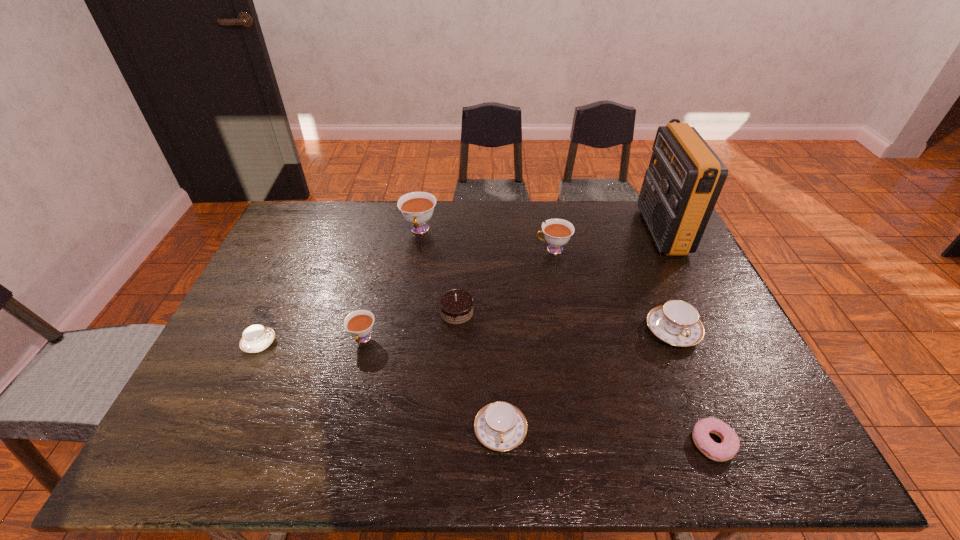
Identify the location of free space between the rightmost blue teacup and the doughnut. (693, 387).

This screenshot has height=540, width=960. Identify the location of vacant area between the smallest white teacup and the pink doughnut. (538, 391).

This screenshot has height=540, width=960. Identify the location of the sixth closest object to the pink doughnut. (359, 323).

Choose which object is the seventh nearest neighbor to the rightmost white teacup. Please provide its 2D coordinates. Your answer should be formatted as a tuple, i.e. [(x, y)], where the tuple contains the x and y coordinates of a point satisfying the conditions above.

[(730, 443)]

Identify the location of the fourth closest teacup to the nearest teacup. (255, 338).

Locate an element on the screen. Image resolution: width=960 pixels, height=540 pixels. the fifth closest teacup relative to the biggest white teacup is located at coordinates (676, 322).

Identify which white teacup is located as the nearest to the biggest white teacup. Please provide its 2D coordinates. Your answer should be formatted as a tuple, i.e. [(x, y)], where the tuple contains the x and y coordinates of a point satisfying the conditions above.

[(557, 232)]

Locate an element on the screen. the second closest white teacup to the radio receiver is located at coordinates (417, 208).

Locate which blue teacup ranks second in proximity to the pink doughnut. Please provide its 2D coordinates. Your answer should be formatted as a tuple, i.e. [(x, y)], where the tuple contains the x and y coordinates of a point satisfying the conditions above.

[(500, 426)]

Locate an element on the screen. the second closest blue teacup to the pink doughnut is located at coordinates [x=500, y=426].